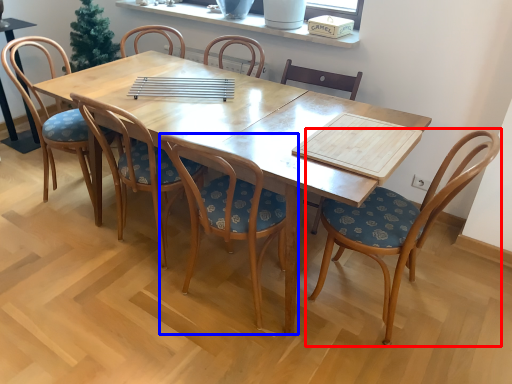
Question: Which object appears farthest to the camera in this image, chair (highlighted by a red box) or chair (highlighted by a blue box)?

Choices:
 (A) chair
 (B) chair

Answer: (A)